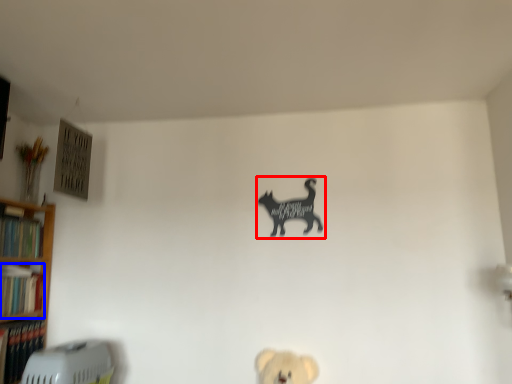
Question: Among these objects, which one is nearest to the camera, animal (highlighted by a red box) or book (highlighted by a blue box)?

Choices:
 (A) animal
 (B) book

Answer: (B)